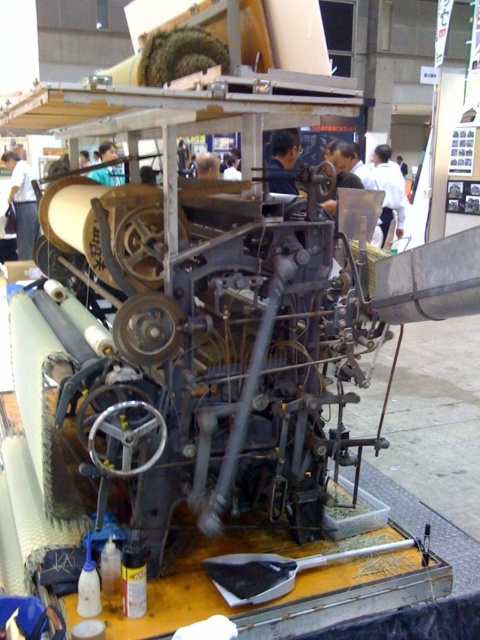
You are an engineer inspecting the industrial machine. You notice two points marked on the machine. The first point is at coordinate point (279, 188) and the second point is at coordinate point (96, 172). Which point is closer to your current position?

Point (279, 188) is closer to the camera than point (96, 172), so the first point is closer to your current position.

You are an engineer inspecting the machine and need to access the point at coordinates point (x=398, y=220) and point (x=295, y=148). Which point is closer to you when standing in front of the machine?

Point (x=295, y=148) is closer to you since it is in front of point (x=398, y=220).

You are an attendee at the trade show and notice two features on the machine operator at the center. The dark blue shirt at center and the dark brown hair at center. Which one is taller?

The dark blue shirt at center has a greater height compared to dark brown hair at center.